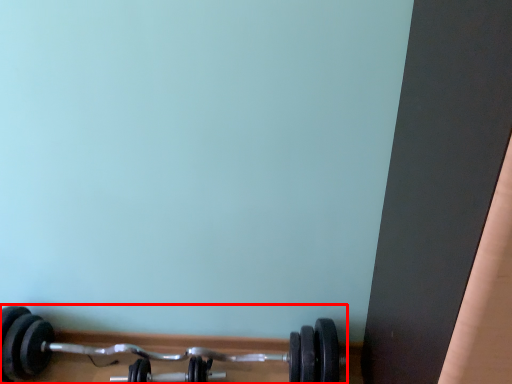
Question: From the image's perspective, considering the relative positions of dumbbell (annotated by the red box) and dumbbell in the image provided, where is dumbbell (annotated by the red box) located with respect to the staircase?

Choices:
 (A) above
 (B) below

Answer: (A)